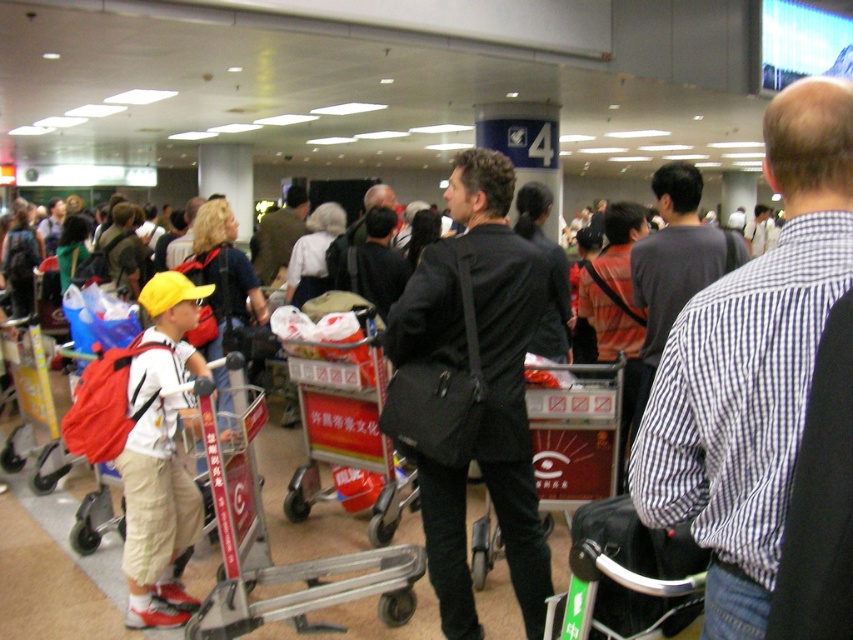
Question: Which of the following is the farthest from the observer?

Choices:
 (A) metallic red trolley at center
 (B) matte red backpack at left

Answer: (A)

Question: Can you confirm if white checkered shirt at center is positioned to the right of metallic red trolley at center?

Choices:
 (A) yes
 (B) no

Answer: (A)

Question: Among these points, which one is nearest to the camera?

Choices:
 (A) [x=178, y=394]
 (B) [x=534, y=284]

Answer: (B)

Question: Is black matte jacket at center to the right of metallic silver trolley at center from the viewer's perspective?

Choices:
 (A) yes
 (B) no

Answer: (A)

Question: Which object appears closest to the camera in this image?

Choices:
 (A) metallic silver trolley at center
 (B) metallic red trolley at center
 (C) black matte jacket at center

Answer: (C)

Question: Is white checkered shirt at center closer to the viewer compared to metallic red trolley at center?

Choices:
 (A) yes
 (B) no

Answer: (A)